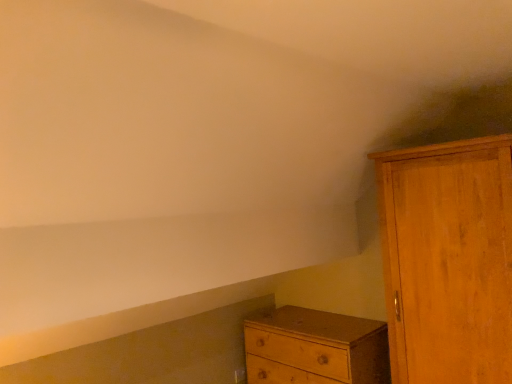
Question: From a real-world perspective, relative to wooden cupboard at right, is wooden chest of drawers at lower center vertically above or below?

Choices:
 (A) above
 (B) below

Answer: (B)

Question: In the image, is wooden chest of drawers at lower center on the left side or the right side of wooden cupboard at right?

Choices:
 (A) left
 (B) right

Answer: (A)

Question: From the image's perspective, is wooden chest of drawers at lower center positioned above or below wooden cupboard at right?

Choices:
 (A) below
 (B) above

Answer: (A)

Question: Is wooden cupboard at right wider or thinner than wooden chest of drawers at lower center?

Choices:
 (A) wide
 (B) thin

Answer: (A)

Question: Is wooden cupboard at right situated inside wooden chest of drawers at lower center or outside?

Choices:
 (A) outside
 (B) inside

Answer: (A)

Question: Based on their positions, is wooden cupboard at right located to the left or right of wooden chest of drawers at lower center?

Choices:
 (A) left
 (B) right

Answer: (B)

Question: Is wooden cupboard at right taller or shorter than wooden chest of drawers at lower center?

Choices:
 (A) short
 (B) tall

Answer: (B)